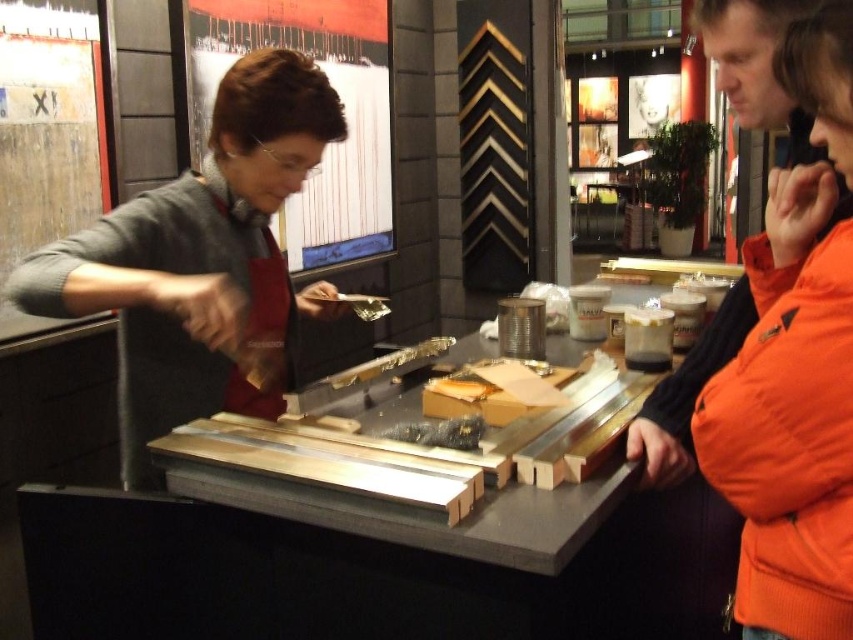
Question: Which object is closer to the camera taking this photo?

Choices:
 (A) yellowish matte cheese at center
 (B) orange puffy jacket at right
 (C) matte gray sweater at center

Answer: (B)

Question: Considering the real-world distances, which object is closest to the orange puffy jacket at right?

Choices:
 (A) yellowish matte cheese at center
 (B) matte gray sweater at center

Answer: (A)

Question: Does orange puffy jacket at right have a smaller size compared to yellowish matte cheese at center?

Choices:
 (A) no
 (B) yes

Answer: (A)

Question: Is matte gray sweater at center wider than orange puffy jacket at right?

Choices:
 (A) yes
 (B) no

Answer: (A)

Question: Is matte gray sweater at center wider than orange puffy jacket at right?

Choices:
 (A) yes
 (B) no

Answer: (A)

Question: Which point is farther to the camera?

Choices:
 (A) matte gray sweater at center
 (B) orange puffy jacket at right
 (C) yellowish matte cheese at center

Answer: (C)